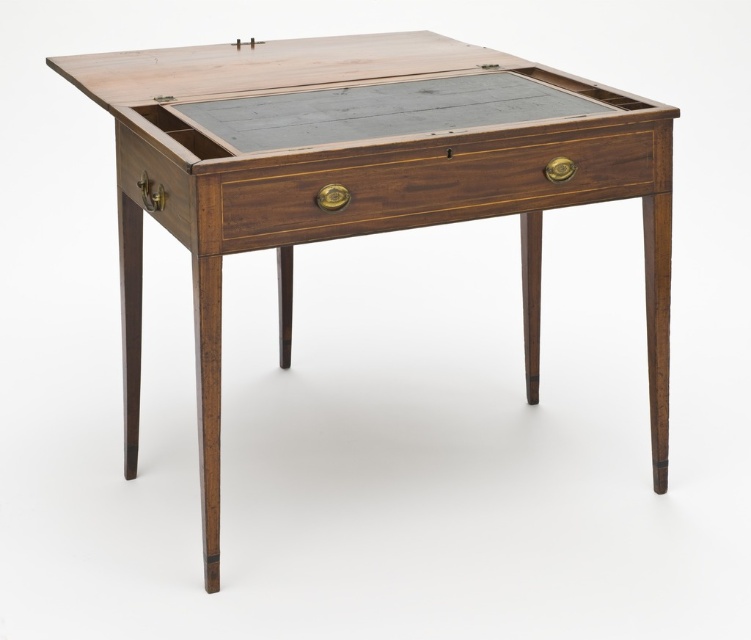
Question: Observing the image, what is the correct spatial positioning of mahogany wood table at center in reference to mahogany drawer at center?

Choices:
 (A) below
 (B) above

Answer: (A)

Question: Which point appears farthest from the camera in this image?

Choices:
 (A) (225, 104)
 (B) (348, 218)
 (C) (122, 129)

Answer: (A)

Question: Among these points, which one is farthest from the camera?

Choices:
 (A) (368, 116)
 (B) (187, 218)

Answer: (A)

Question: Does mahogany drawer at center have a larger size compared to mahogany wood drawer at left?

Choices:
 (A) yes
 (B) no

Answer: (A)

Question: Is mahogany drawer at center to the right of mahogany wood drawer at left from the viewer's perspective?

Choices:
 (A) yes
 (B) no

Answer: (A)

Question: Based on their relative distances, which object is farther from the mahogany wood drawer at left?

Choices:
 (A) mahogany drawer at center
 (B) mahogany wood table at center

Answer: (A)